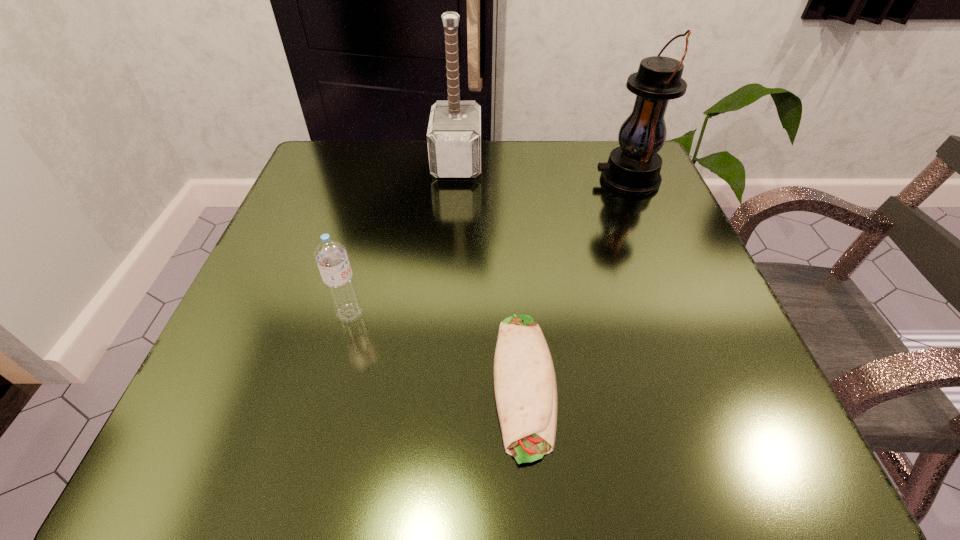
This screenshot has width=960, height=540. I want to click on empty space between the second object from left to right and the leftmost object, so click(x=403, y=238).

The image size is (960, 540). I want to click on free spot between the third tallest object and the rightmost object, so click(489, 246).

The width and height of the screenshot is (960, 540). I want to click on empty space between the hammer and the water bottle, so click(403, 238).

Locate which object ranks third in proximity to the lantern. Please provide its 2D coordinates. Your answer should be formatted as a tuple, i.e. [(x, y)], where the tuple contains the x and y coordinates of a point satisfying the conditions above.

[(330, 255)]

Where is `object that is the closest one to the hammer`? This screenshot has height=540, width=960. object that is the closest one to the hammer is located at coordinates (633, 168).

The width and height of the screenshot is (960, 540). Find the location of `free space that satisfies the following two spatial constraints: 1. above the lantern, indicating its light source; 2. at the bitten end of the burrito`. free space that satisfies the following two spatial constraints: 1. above the lantern, indicating its light source; 2. at the bitten end of the burrito is located at coordinates (710, 382).